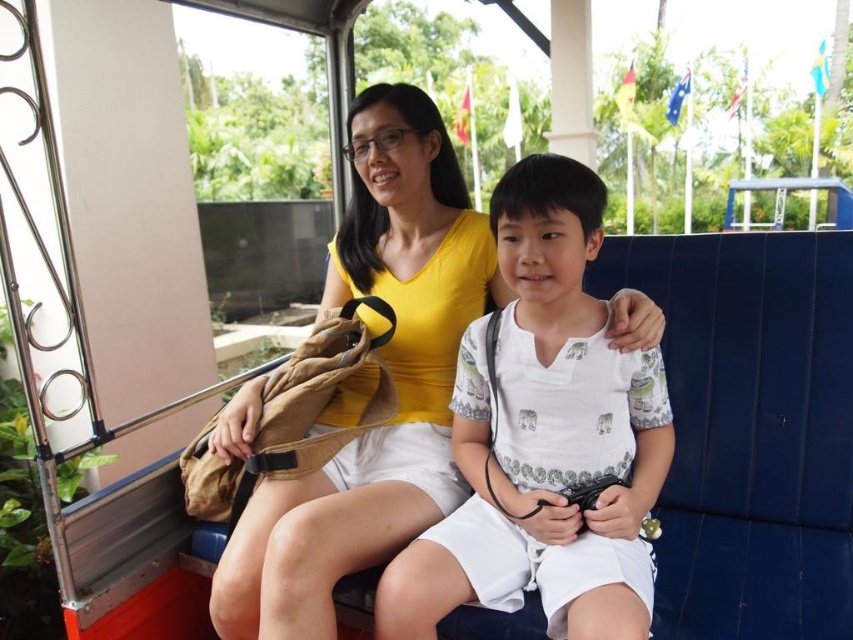
Question: Can you confirm if white cotton shirt at center is positioned above yellow matte shirt at center?

Choices:
 (A) no
 (B) yes

Answer: (A)

Question: Is white cotton shirt at center to the right of yellow matte shirt at center from the viewer's perspective?

Choices:
 (A) yes
 (B) no

Answer: (A)

Question: Which object is farther from the camera taking this photo?

Choices:
 (A) yellow matte shirt at center
 (B) white cotton shirt at center

Answer: (A)

Question: Is white cotton shirt at center to the left of yellow matte shirt at center from the viewer's perspective?

Choices:
 (A) yes
 (B) no

Answer: (B)

Question: Among these points, which one is farthest from the camera?

Choices:
 (A) (314, 554)
 (B) (619, 435)

Answer: (B)